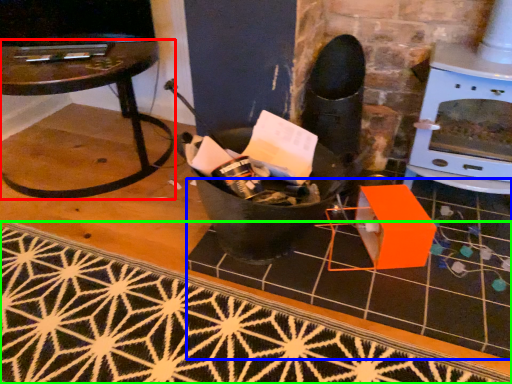
Question: Which is nearer to the table (highlighted by a red box)? tile (highlighted by a blue box) or doormat (highlighted by a green box).

Choices:
 (A) tile
 (B) doormat

Answer: (B)